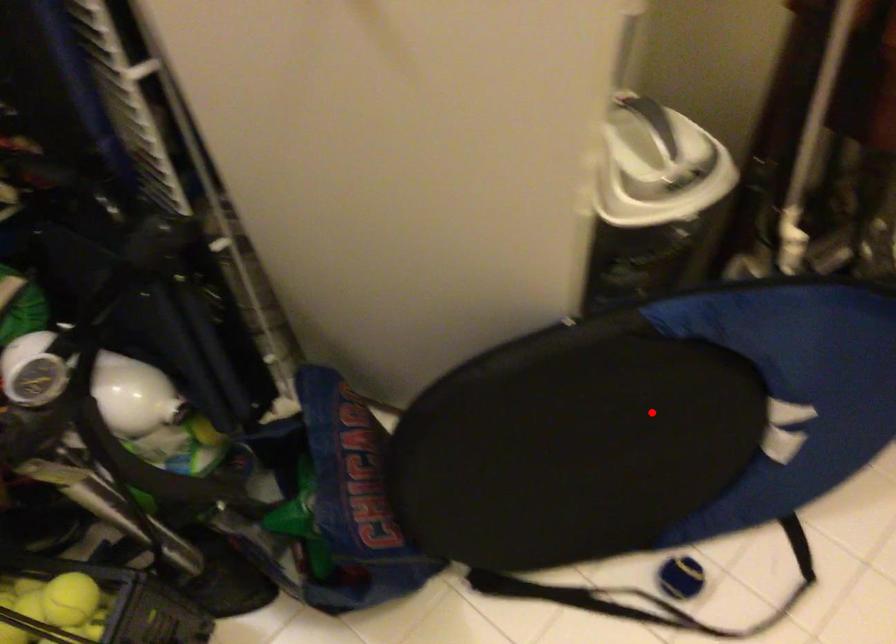
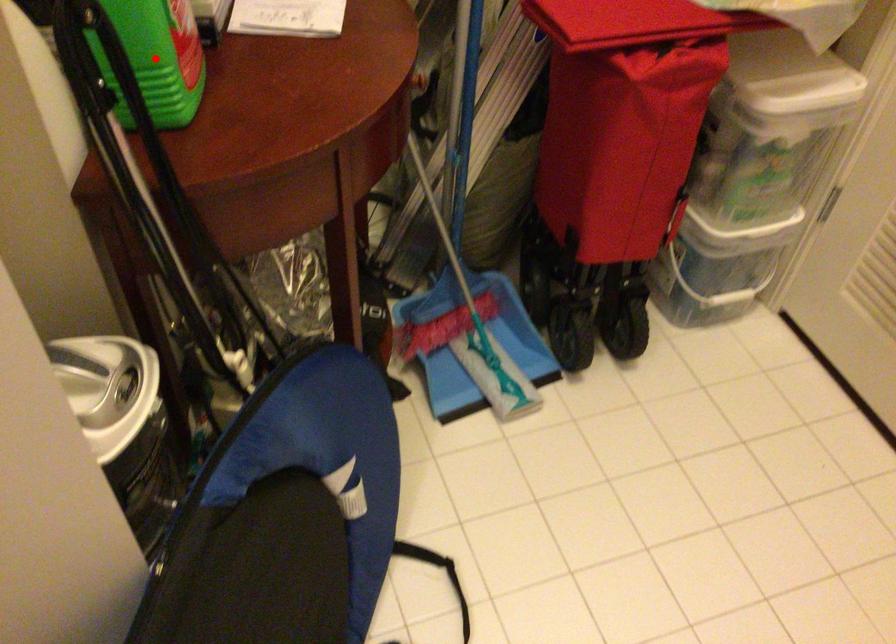
In the scene shown: I am providing you with two images of the same scene from different viewpoints. A red point is marked on the first image and another point is marked on the second image. Are the points marked in image1 and image2 representing the same 3D position?

No